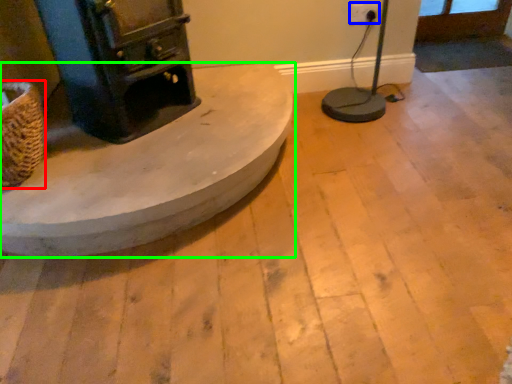
Question: Based on their relative distances, which object is farther from basket (highlighted by a red box)? Choose from electric outlet (highlighted by a blue box) and furniture (highlighted by a green box).

Choices:
 (A) electric outlet
 (B) furniture

Answer: (A)